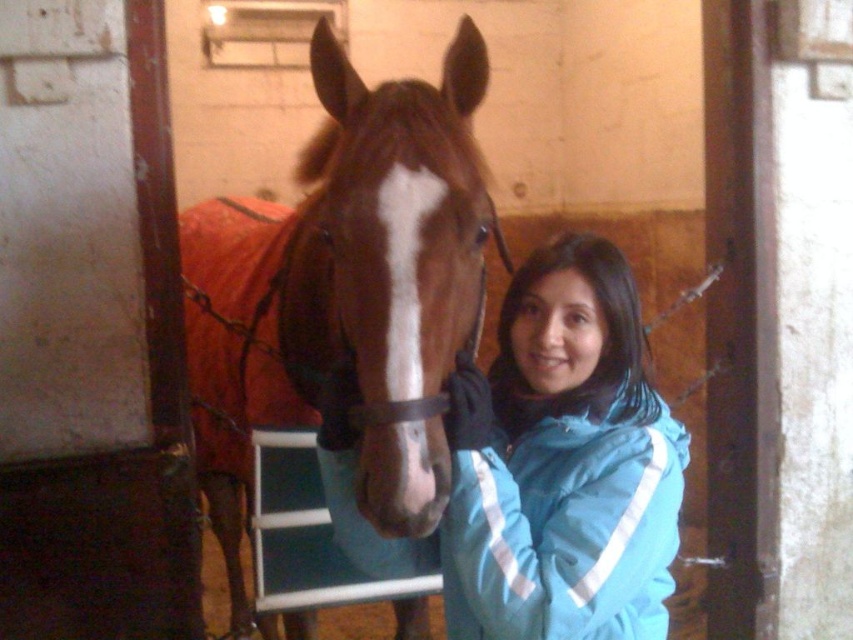
In the scene shown: Is brown glossy horse at center below blue synthetic jacket at center?

No, brown glossy horse at center is not below blue synthetic jacket at center.

Measure the distance between point (253, 310) and camera.

Point (253, 310) is 2.35 meters away from camera.

What do you see at coordinates (344, 291) in the screenshot? Image resolution: width=853 pixels, height=640 pixels. I see `brown glossy horse at center` at bounding box center [344, 291].

Locate an element on the screen. This screenshot has width=853, height=640. brown glossy horse at center is located at coordinates (344, 291).